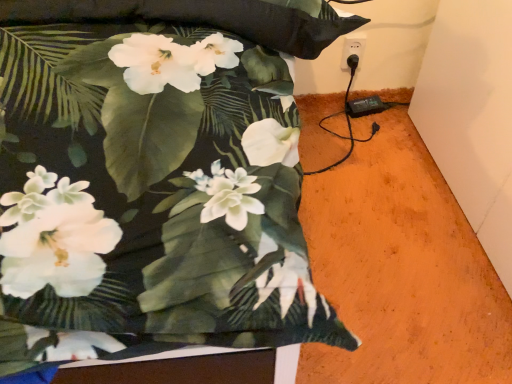
The height and width of the screenshot is (384, 512). I want to click on white plastic outlet at upper right, so click(353, 49).

This screenshot has height=384, width=512. Describe the element at coordinates (353, 49) in the screenshot. I see `white plastic outlet at upper right` at that location.

Locate an element on the screen. The width and height of the screenshot is (512, 384). white plastic outlet at upper right is located at coordinates (353, 49).